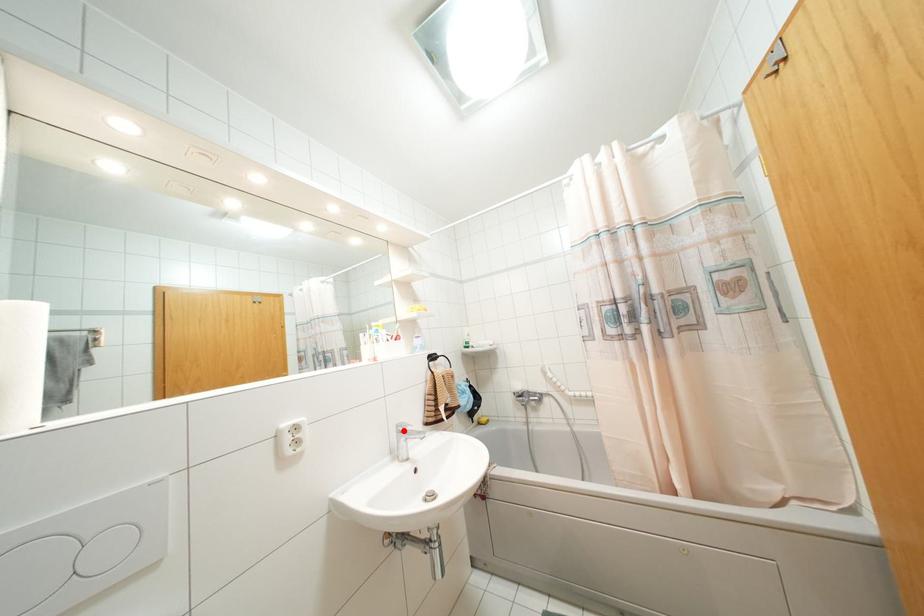
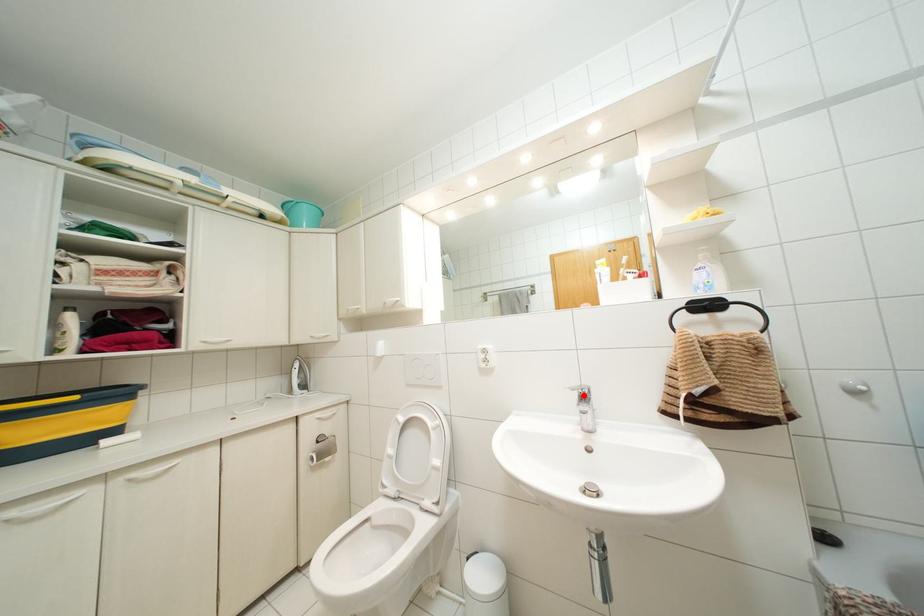
I am providing you with two images of the same scene from different viewpoints. A red point is marked on the first image and another point is marked on the second image. Are the points marked in image1 and image2 representing the same 3D position?

Yes